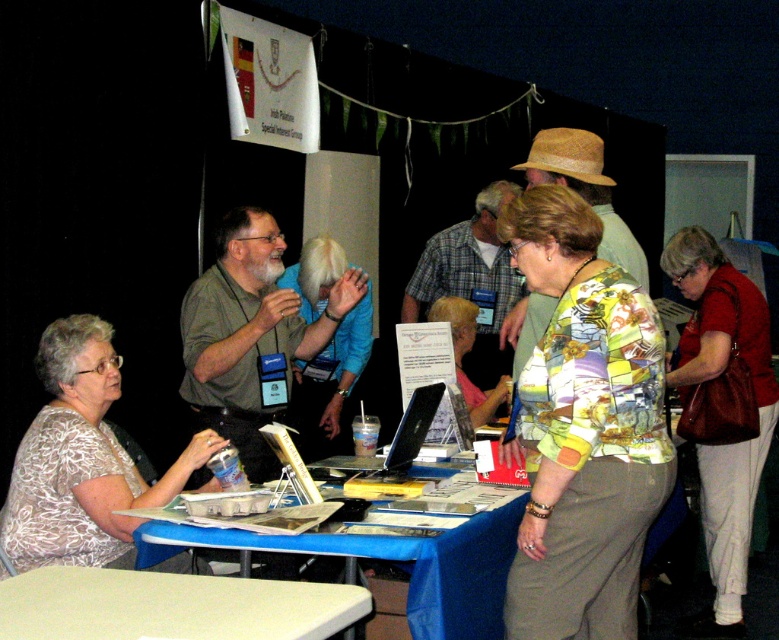
Question: Does printed fabric blouse at center have a greater width compared to white floral blouse at lower left?

Choices:
 (A) no
 (B) yes

Answer: (A)

Question: Which of the following is the closest to the observer?

Choices:
 (A) 427,540
 (B) 446,321
 (C) 72,342
 (D) 72,632

Answer: (D)

Question: Which object appears farthest from the camera in this image?

Choices:
 (A) light green plastic table at lower left
 (B) red leather purse at lower right
 (C) blue fabric table at lower center

Answer: (B)

Question: Which object is the farthest from the printed fabric blouse at center?

Choices:
 (A) floral print blouse at center
 (B) blue fabric table at lower center

Answer: (A)

Question: Can you confirm if printed fabric blouse at center is wider than light green plastic table at lower left?

Choices:
 (A) no
 (B) yes

Answer: (A)

Question: Can you confirm if printed fabric blouse at center is positioned below blue fabric table at lower center?

Choices:
 (A) no
 (B) yes

Answer: (A)